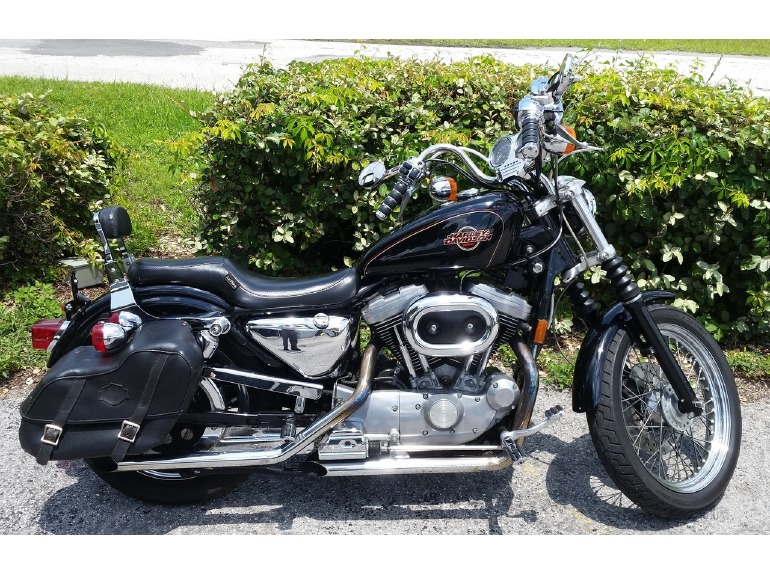
Where is `handles`? The image size is (770, 574). handles is located at coordinates (x=527, y=131), (x=399, y=178).